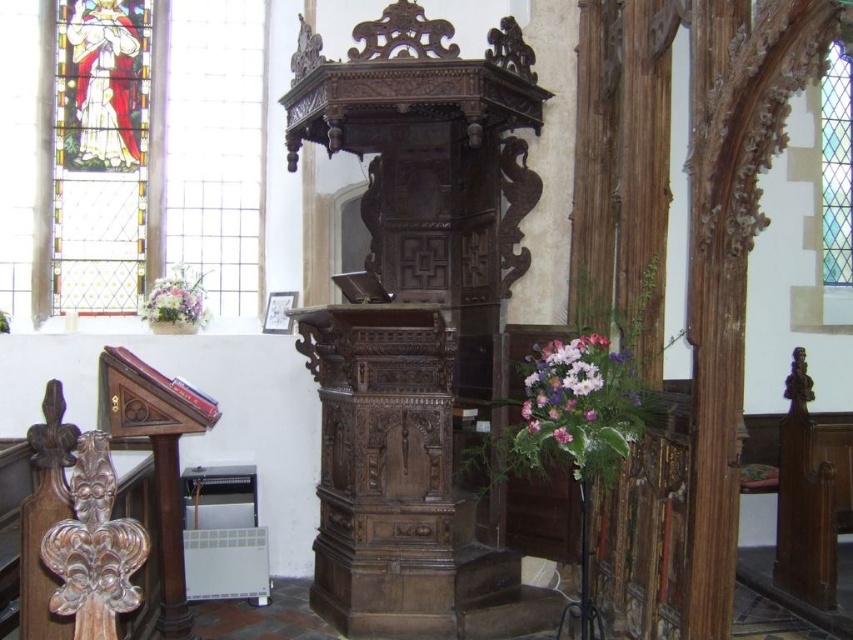
Question: Considering the real-world distances, which object is closest to the fluffy floral bouquet at lower left?

Choices:
 (A) stained glass window at upper right
 (B) purple floral bouquet at right
 (C) dark brown wood pulpit at center
 (D) pink floral bouquet at center

Answer: (C)

Question: Which point is farther to the camera?

Choices:
 (A) pink floral bouquet at center
 (B) stained glass window at upper right

Answer: (B)

Question: Among these points, which one is nearest to the camera?

Choices:
 (A) (259, 275)
 (B) (187, 321)

Answer: (B)

Question: Is fluffy floral bouquet at lower left bigger than pink floral bouquet at center?

Choices:
 (A) no
 (B) yes

Answer: (B)

Question: Does stained glass figure at upper left have a larger size compared to purple floral bouquet at right?

Choices:
 (A) no
 (B) yes

Answer: (B)

Question: Is dark brown wood pulpit at center to the left of pink floral bouquet at center from the viewer's perspective?

Choices:
 (A) yes
 (B) no

Answer: (A)